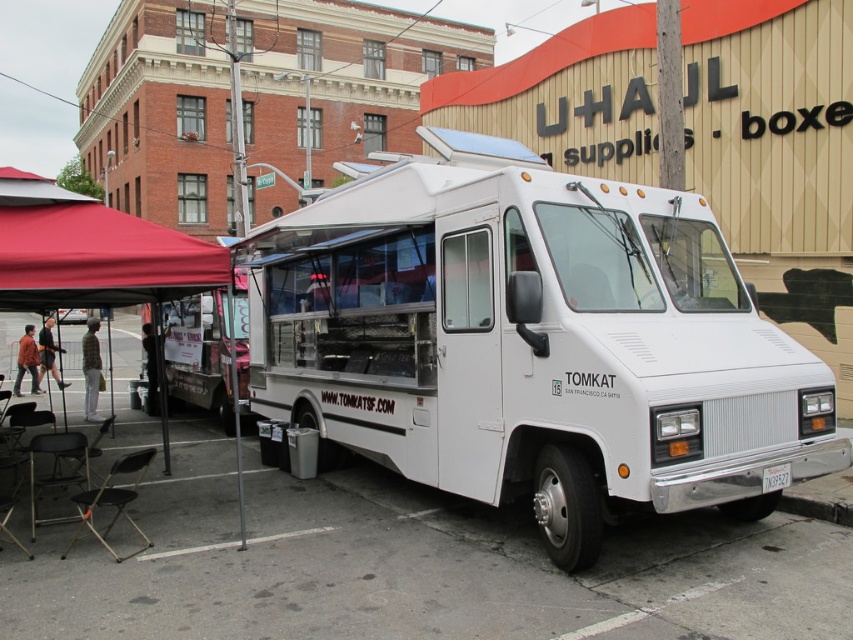
You are a delivery driver who needs to locate the white matte food truck at center. According to the map coordinates, where exactly is it located?

The white matte food truck at center is located at point coordinates of (532, 342).

You are a delivery driver who needs to park your truck, which is 2 meters wide, in the space between the white matte food truck at center and the red fabric canopy at left. Based on the scene description, can your truck fit in that space?

The white matte food truck at center is thinner than the red fabric canopy at left. However, the exact width of the space between them isn not provided in the objects description. Therefore, it is impossible to determine if the delivery truck can fit without additional information.

You are a delivery person with a cart that can carry items up to 6 meters. You need to move a package from the red fabric canopy at left to the white matte food truck at center. Can your cart handle the distance?

The distance between the white matte food truck at center and the red fabric canopy at left is 5.45 meters, which is within the cart capacity of 6 meters. The cart can handle the distance.